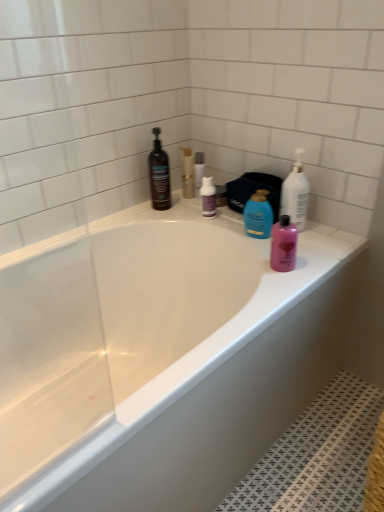
The width and height of the screenshot is (384, 512). What are the coordinates of `free space behind pink glossy bottle at right, the third toiletry when ordered from left to right` in the screenshot? It's located at (266, 242).